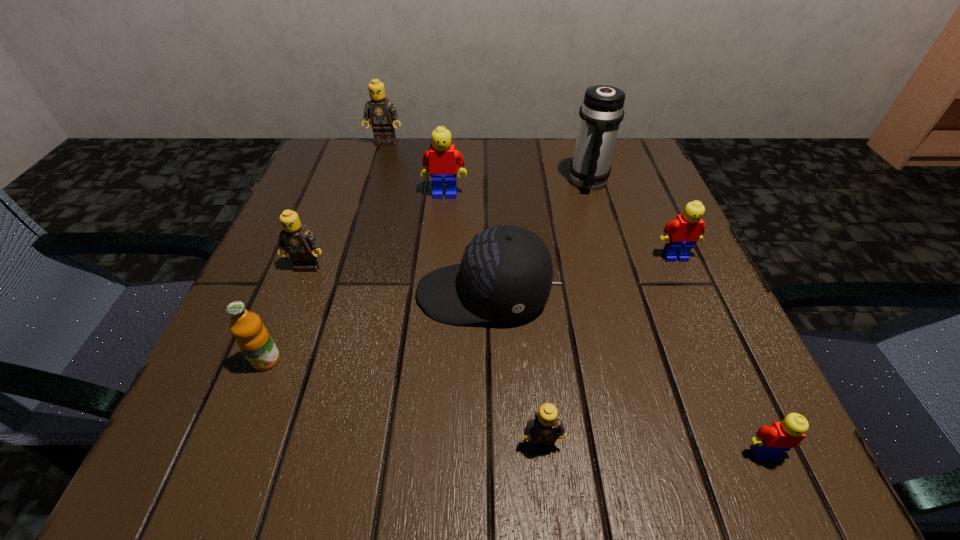
Locate an element on the screen. The height and width of the screenshot is (540, 960). free space at the left edge is located at coordinates (299, 276).

Find the location of `free space at the right edge`. free space at the right edge is located at coordinates (644, 227).

In the image, there is a desktop. Identify the location of vacant space at the far left corner. The height and width of the screenshot is (540, 960). (364, 160).

In the image, there is a desktop. At what (x,y) coordinates should I click in order to perform the action: click on free space at the near right corner. Please return your answer as a coordinate pair (x, y). Image resolution: width=960 pixels, height=540 pixels. Looking at the image, I should click on (774, 422).

You are a GUI agent. You are given a task and a screenshot of the screen. Output one action in this format:
    pyautogui.click(x=<x>, y=<y>)
    Task: Click on the free spot between the smallest yellow Lego and the second farthest yellow Lego
    The image size is (960, 540).
    Given the screenshot: What is the action you would take?
    pyautogui.click(x=720, y=355)

Find the location of a particular element. This screenshot has height=540, width=960. vacant space that's between the second biggest yellow Lego and the farthest tan Lego is located at coordinates (530, 199).

Where is `empty location between the second nearest yellow Lego and the farthest Lego`? empty location between the second nearest yellow Lego and the farthest Lego is located at coordinates (530, 199).

At what (x,y) coordinates should I click in order to perform the action: click on vacant area that lies between the second biggest tan Lego and the baseball cap. Please return your answer as a coordinate pair (x, y). This screenshot has width=960, height=540. Looking at the image, I should click on (396, 280).

At what (x,y) coordinates should I click in order to perform the action: click on free spot between the baseball cap and the second smallest tan Lego. Please return your answer as a coordinate pair (x, y). Looking at the image, I should click on (396, 280).

The width and height of the screenshot is (960, 540). What are the coordinates of `free area in between the tallest object and the seventh farthest object` in the screenshot? It's located at (427, 271).